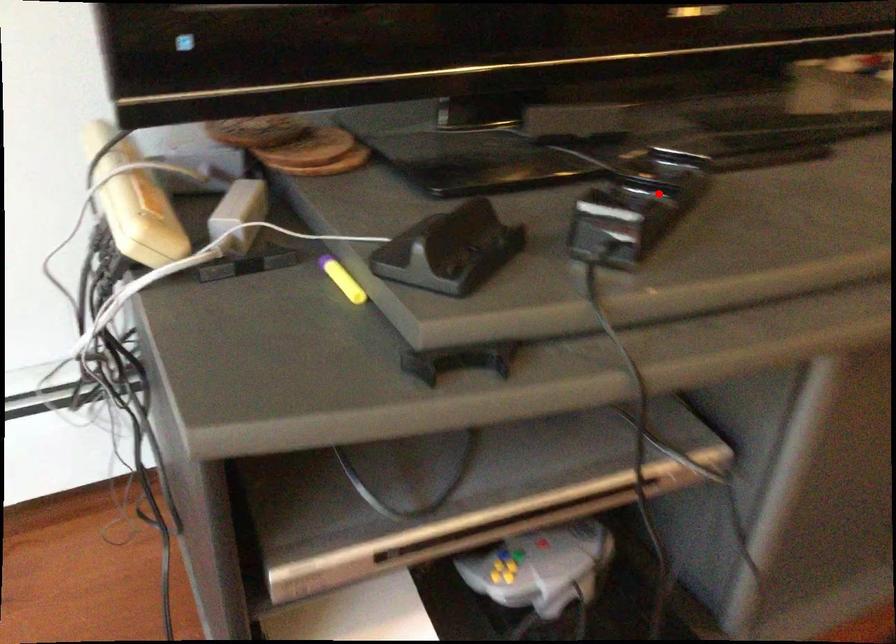
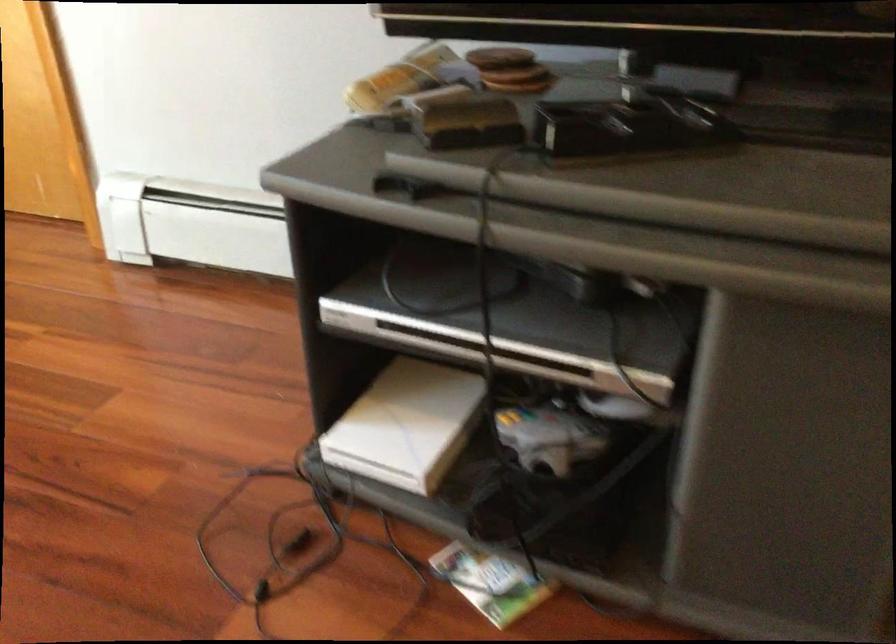
Question: I am providing you with two images of the same scene from different viewpoints. Image1 has a red point marked. In image2, the corresponding 3D location appears at what relative position? Reply with the corresponding letter.

Choices:
 (A) Closer
 (B) Farther

Answer: (B)